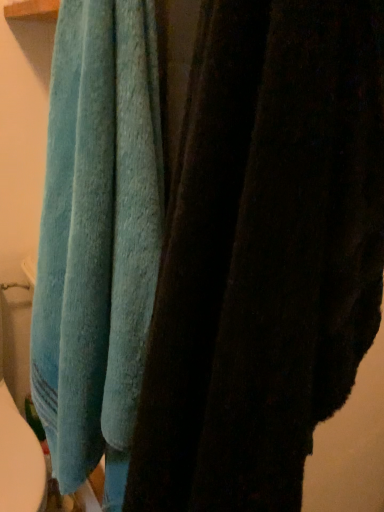
Question: Is blue soft towel at upper left, the 1th towel from the right, facing away from teal soft towel at left, placed as the 1th towel when sorted from left to right?

Choices:
 (A) yes
 (B) no

Answer: (B)

Question: Is blue soft towel at upper left, the 1th towel from the right, further to camera compared to teal soft towel at left, which is counted as the second towel, starting from the right?

Choices:
 (A) no
 (B) yes

Answer: (A)

Question: Is blue soft towel at upper left, the second towel positioned from the left, not close to teal soft towel at left, which is counted as the second towel, starting from the right?

Choices:
 (A) no
 (B) yes

Answer: (A)

Question: Could you tell me if blue soft towel at upper left, the second towel positioned from the left, is facing teal soft towel at left, placed as the 1th towel when sorted from left to right?

Choices:
 (A) no
 (B) yes

Answer: (A)

Question: Can you confirm if blue soft towel at upper left, the 1th towel from the right, is shorter than teal soft towel at left, which is counted as the second towel, starting from the right?

Choices:
 (A) yes
 (B) no

Answer: (A)

Question: Is blue soft towel at upper left, the second towel positioned from the left, outside of teal soft towel at left, placed as the 1th towel when sorted from left to right?

Choices:
 (A) no
 (B) yes

Answer: (B)

Question: Is teal soft towel at left, which is counted as the second towel, starting from the right, with blue soft towel at upper left, the second towel positioned from the left?

Choices:
 (A) yes
 (B) no

Answer: (B)

Question: From the image's perspective, is teal soft towel at left, which is counted as the second towel, starting from the right, located beneath blue soft towel at upper left, the second towel positioned from the left?

Choices:
 (A) no
 (B) yes

Answer: (A)

Question: Would you say blue soft towel at upper left, the second towel positioned from the left, is part of teal soft towel at left, placed as the 1th towel when sorted from left to right,'s contents?

Choices:
 (A) no
 (B) yes

Answer: (A)

Question: Is teal soft towel at left, placed as the 1th towel when sorted from left to right, positioned before blue soft towel at upper left, the 1th towel from the right?

Choices:
 (A) no
 (B) yes

Answer: (A)

Question: Does teal soft towel at left, which is counted as the second towel, starting from the right, come behind blue soft towel at upper left, the 1th towel from the right?

Choices:
 (A) no
 (B) yes

Answer: (B)

Question: Is teal soft towel at left, placed as the 1th towel when sorted from left to right, bigger than blue soft towel at upper left, the 1th towel from the right?

Choices:
 (A) no
 (B) yes

Answer: (B)

Question: From a real-world perspective, is teal soft towel at left, placed as the 1th towel when sorted from left to right, above or below blue soft towel at upper left, the 1th towel from the right?

Choices:
 (A) below
 (B) above

Answer: (A)